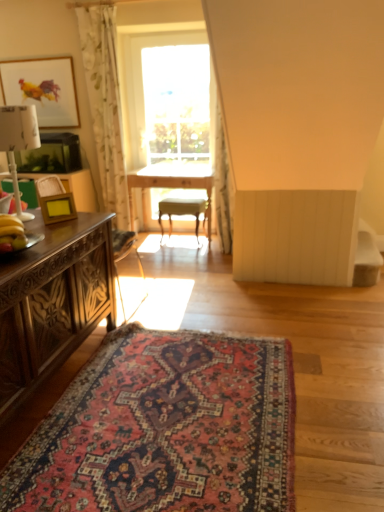
The image size is (384, 512). In order to click on vacant point above carpeted mat at lower center (from a real-world perspective) in this screenshot , I will do click(178, 404).